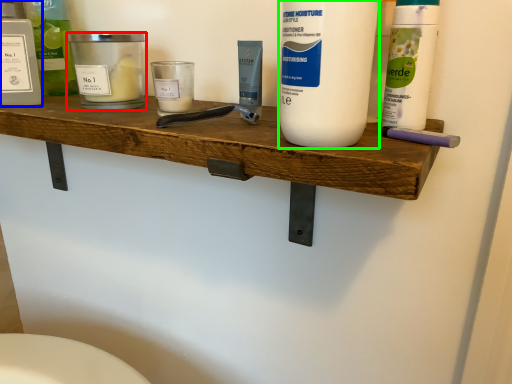
Question: Which is nearer to the personal care (highlighted by a red box)? personal care (highlighted by a blue box) or cleaning product (highlighted by a green box).

Choices:
 (A) personal care
 (B) cleaning product

Answer: (A)